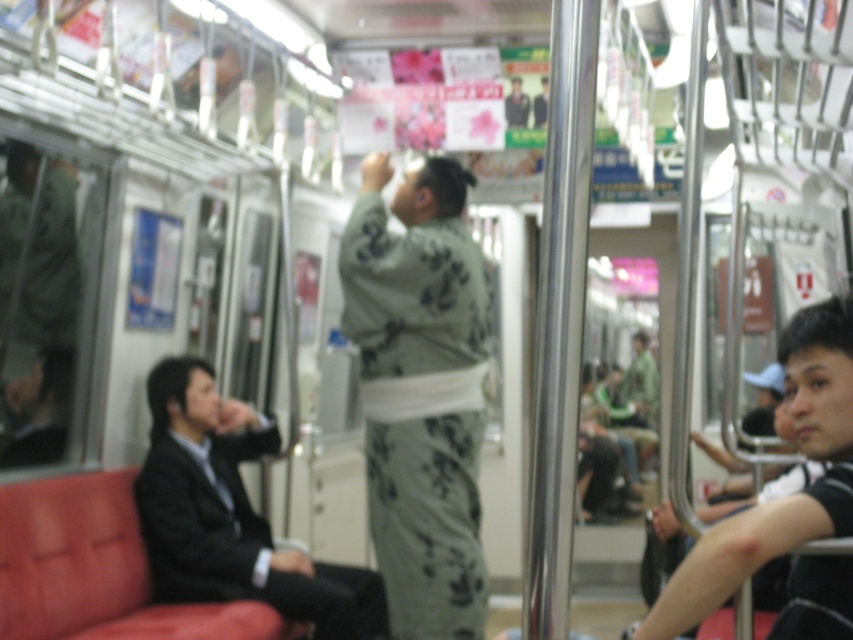
You are a photographer standing in the subway train and want to take a photo of the black suit at left and the matte black shirt at right. Since the scene is blurry, you need to focus on the taller object first. Which object should you focus on first?

The black suit at left is taller than the matte black shirt at right, so you should focus on the black suit at left first.

You are a passenger on a subway train and want to know if there is enough space between the light green kimono at center and the black suit at left to walk through. The minimum space required for a person to walk through is 24 inches. Can you walk through the space between them?

The light green kimono at center and black suit at left are 31.67 inches apart, which is more than the required 24 inches. Therefore, you can walk through the space between them.